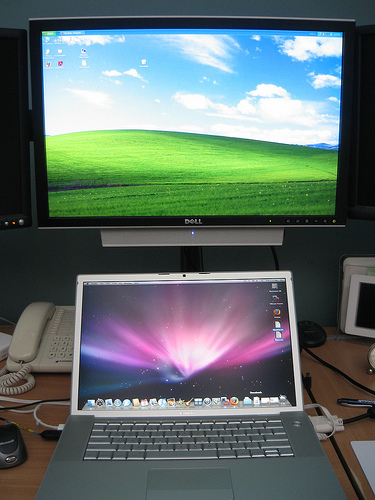
Where is `curly telephone cord`? curly telephone cord is located at coordinates (19, 377).